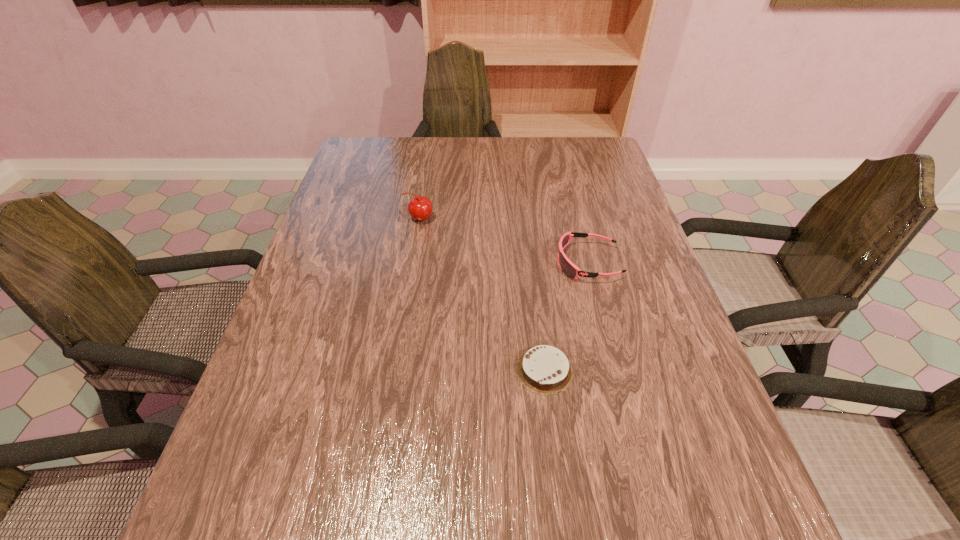
You are a GUI agent. You are given a task and a screenshot of the screen. Output one action in this format:
    pyautogui.click(x=<x>, y=<y>)
    Task: Click on the farthest object
    The image size is (960, 540).
    Given the screenshot: What is the action you would take?
    pyautogui.click(x=420, y=208)

At what (x,y) coordinates should I click in order to perform the action: click on the leftmost object. Please return your answer as a coordinate pair (x, y). Looking at the image, I should click on point(420,208).

Image resolution: width=960 pixels, height=540 pixels. Identify the location of the second nearest object. (568, 268).

This screenshot has width=960, height=540. Find the location of `the second shortest object`. the second shortest object is located at coordinates (568, 268).

Where is `the nearest object`? The height and width of the screenshot is (540, 960). the nearest object is located at coordinates (544, 369).

You are a GUI agent. You are given a task and a screenshot of the screen. Output one action in this format:
    pyautogui.click(x=<x>, y=<y>)
    Task: Click on the second object from left to right
    Image resolution: width=960 pixels, height=540 pixels.
    Given the screenshot: What is the action you would take?
    pyautogui.click(x=544, y=369)

At what (x,y) coordinates should I click in order to perform the action: click on vacant region located 0.370m on the right of the cherry. Please return your answer as a coordinate pair (x, y). Looking at the image, I should click on (569, 219).

The height and width of the screenshot is (540, 960). Find the location of `free point located on the front-facing side of the rightmost object`. free point located on the front-facing side of the rightmost object is located at coordinates click(x=425, y=262).

Where is `free point located 0.180m on the front-facing side of the rightmost object`? free point located 0.180m on the front-facing side of the rightmost object is located at coordinates (482, 262).

Locate an element on the screen. Image resolution: width=960 pixels, height=540 pixels. vacant region located on the front-facing side of the rightmost object is located at coordinates (417, 262).